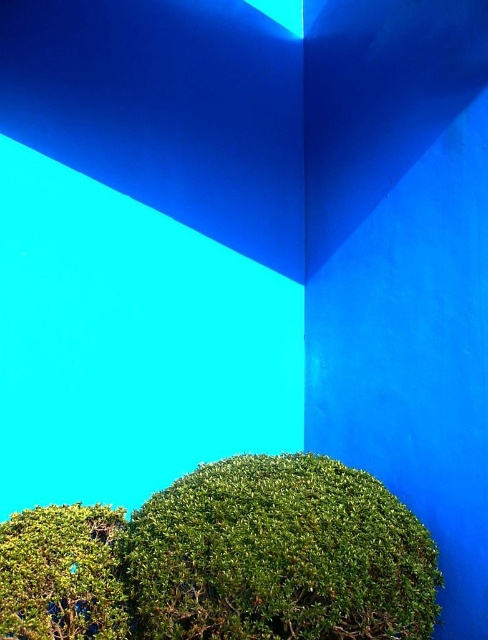
Question: Among these objects, which one is farthest from the camera?

Choices:
 (A) green matte bush at lower left
 (B) green matte bush at lower center

Answer: (B)

Question: Is green matte bush at lower center further to camera compared to green matte bush at lower left?

Choices:
 (A) no
 (B) yes

Answer: (B)

Question: Does green matte bush at lower center come behind green matte bush at lower left?

Choices:
 (A) yes
 (B) no

Answer: (A)

Question: Considering the relative positions of green matte bush at lower center and green matte bush at lower left in the image provided, where is green matte bush at lower center located with respect to green matte bush at lower left?

Choices:
 (A) below
 (B) above

Answer: (B)